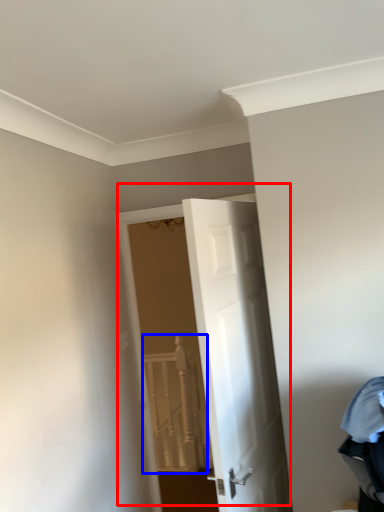
Question: Which of the following is the closest to the observer, door (highlighted by a red box) or rail (highlighted by a blue box)?

Choices:
 (A) door
 (B) rail

Answer: (A)